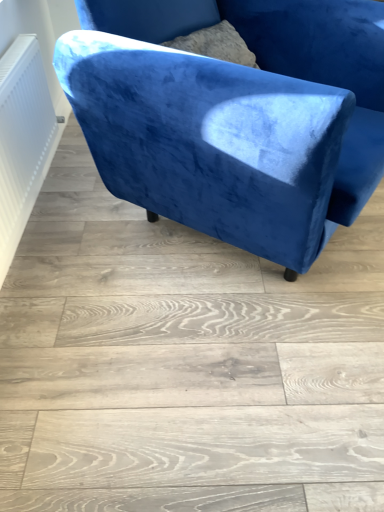
Question: In terms of size, does velvet blue armchair at upper center appear bigger or smaller than white textured radiator at left?

Choices:
 (A) small
 (B) big

Answer: (B)

Question: Visually, is velvet blue armchair at upper center positioned to the left or to the right of white textured radiator at left?

Choices:
 (A) left
 (B) right

Answer: (B)

Question: Considering the positions of velvet blue armchair at upper center and white textured radiator at left in the image, is velvet blue armchair at upper center taller or shorter than white textured radiator at left?

Choices:
 (A) tall
 (B) short

Answer: (A)

Question: From their relative heights in the image, would you say white textured radiator at left is taller or shorter than velvet blue armchair at upper center?

Choices:
 (A) short
 (B) tall

Answer: (A)

Question: Considering the positions of point (24, 65) and point (311, 157), is point (24, 65) closer or farther from the camera than point (311, 157)?

Choices:
 (A) farther
 (B) closer

Answer: (A)

Question: Would you say white textured radiator at left is to the left or to the right of velvet blue armchair at upper center in the picture?

Choices:
 (A) left
 (B) right

Answer: (A)

Question: Based on their sizes in the image, would you say white textured radiator at left is bigger or smaller than velvet blue armchair at upper center?

Choices:
 (A) small
 (B) big

Answer: (A)